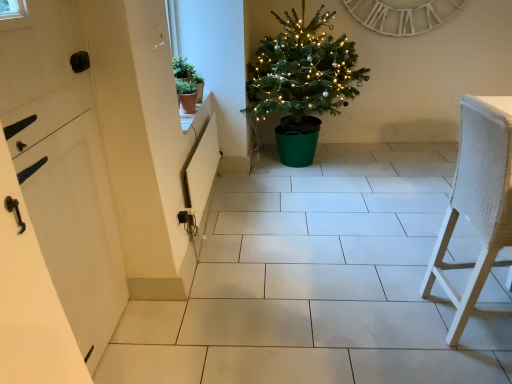
Question: Based on their sizes in the image, would you say green matte plant pot at upper left, which is the second houseplant in bottom-to-top order, is bigger or smaller than white painted wood door at left?

Choices:
 (A) small
 (B) big

Answer: (A)

Question: Is green matte plant pot at upper left, which is the second houseplant in bottom-to-top order, in front of or behind white painted wood door at left in the image?

Choices:
 (A) behind
 (B) front

Answer: (A)

Question: Estimate the real-world distances between objects in this image. Which object is closer to the green plastic christmas tree at center?

Choices:
 (A) matte brown table at upper center
 (B) white wooden clock at upper center
 (C) green matte plant pot at upper left, which is the second houseplant in bottom-to-top order
 (D) green matte pot at upper left, arranged as the first houseplant when ordered from the bottom
 (E) white woven chair at right

Answer: (B)

Question: Considering the real-world distances, which object is farthest from the matte brown table at upper center?

Choices:
 (A) white woven chair at right
 (B) white painted wood door at left
 (C) green matte plant pot at upper left, the 1th houseplant from the top
 (D) green plastic christmas tree at center
 (E) green matte pot at upper left, arranged as the first houseplant when ordered from the bottom

Answer: (A)